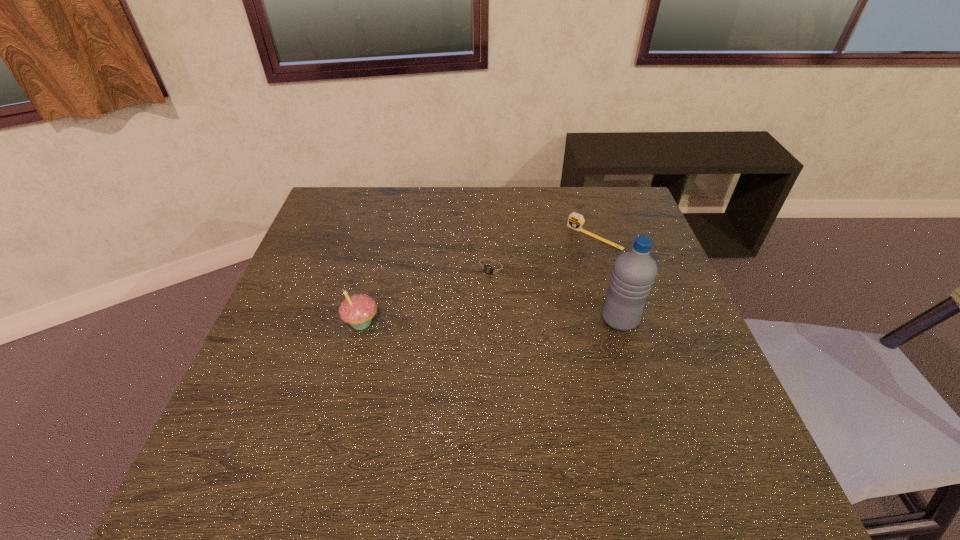
At what (x,y) coordinates should I click in order to perform the action: click on free spot on the desktop that is between the cupcake and the tallest object and is positioned at the front of the farthest object with the tape extended. Please return your answer as a coordinate pair (x, y). Looking at the image, I should click on (504, 321).

The width and height of the screenshot is (960, 540). Identify the location of free space on the desktop that is between the cupcake and the water bottle and is positioned on the face of the third object from right to left. (453, 321).